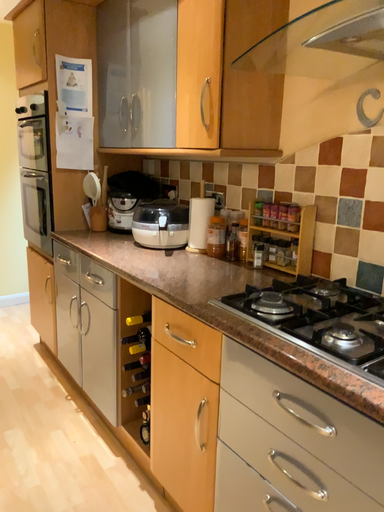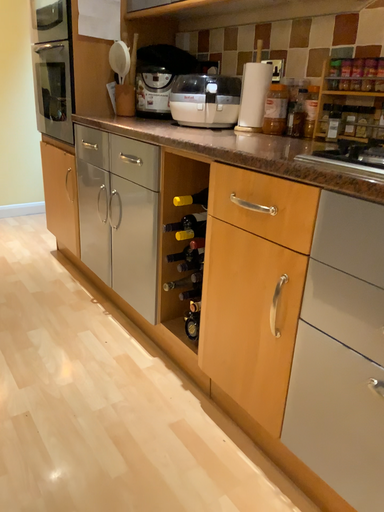
Question: Which way did the camera rotate in the video?

Choices:
 (A) rotated downward
 (B) rotated upward

Answer: (A)